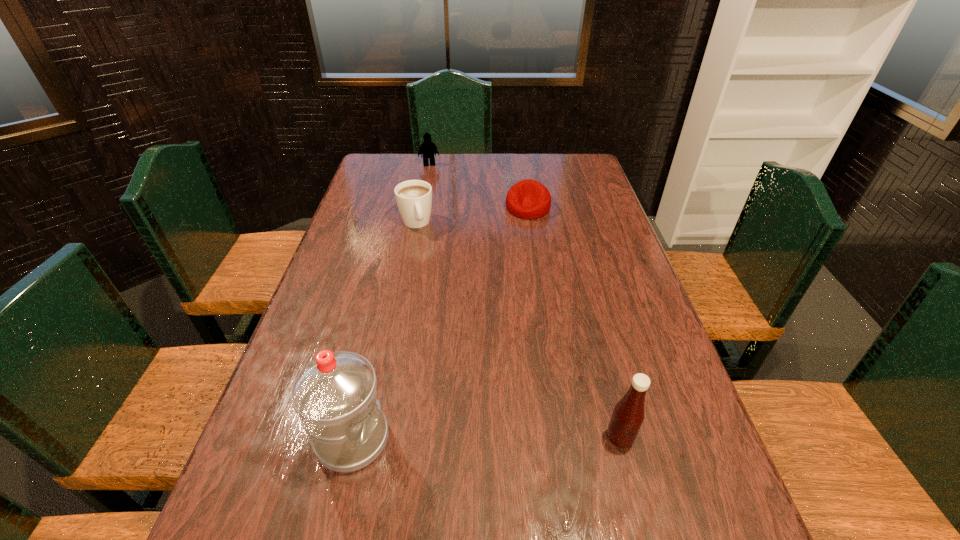
At what (x,y) coordinates should I click in order to perform the action: click on water bottle. Please return your answer as a coordinate pair (x, y). Looking at the image, I should click on (335, 396).

Identify the location of Tabasco sauce. The image size is (960, 540). (628, 415).

The width and height of the screenshot is (960, 540). What are the coordinates of `the rightmost object` in the screenshot? It's located at (628, 415).

Where is `Lego`? This screenshot has height=540, width=960. Lego is located at coordinates click(428, 148).

Locate an element on the screen. cappuccino is located at coordinates (413, 197).

Find the location of a particular element. beanbag is located at coordinates (527, 199).

Where is `the shortest object`? The width and height of the screenshot is (960, 540). the shortest object is located at coordinates (527, 199).

Identify the location of vacant area located on the handle side of the water bottle. (414, 439).

What are the coordinates of `vacant position located 0.220m on the back of the rightmost object` in the screenshot? It's located at (596, 345).

Where is `free space located on the face of the Lego`? The height and width of the screenshot is (540, 960). free space located on the face of the Lego is located at coordinates (440, 208).